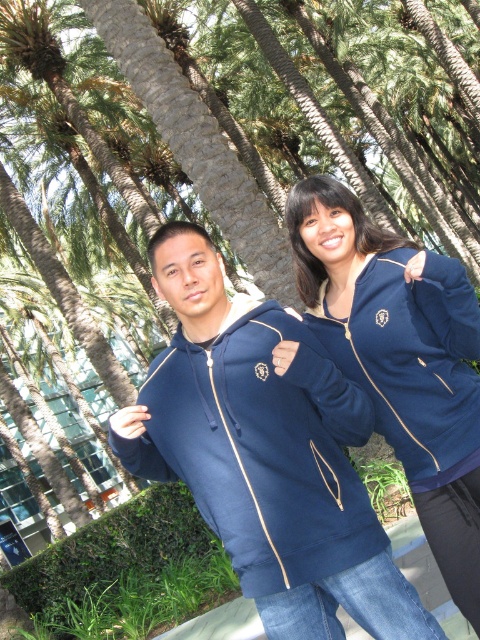
Who is higher up, navy blue hoodie at center or navy blue fleece sweatshirt at upper right?

navy blue fleece sweatshirt at upper right is higher up.

Looking at this image, is navy blue hoodie at center wider than navy blue fleece sweatshirt at upper right?

Yes, navy blue hoodie at center is wider than navy blue fleece sweatshirt at upper right.

Measure the distance between point (460,540) and camera.

Point (460,540) and camera are 2.20 meters apart.

Identify the location of navy blue hoodie at center. (402, 358).

Measure the distance between matte blue sweatshirt at center and camera.

The distance of matte blue sweatshirt at center from camera is 1.94 meters.

Where is `matte blue sweatshirt at center`? The image size is (480, 640). matte blue sweatshirt at center is located at coordinates (261, 448).

Is matte blue sweatshirt at center smaller than navy blue hoodie at center?

Correct, matte blue sweatshirt at center occupies less space than navy blue hoodie at center.

Does matte blue sweatshirt at center appear on the left side of navy blue hoodie at center?

Indeed, matte blue sweatshirt at center is positioned on the left side of navy blue hoodie at center.

Which is in front, point (345, 432) or point (418, 515)?

Point (345, 432)

You are a GUI agent. You are given a task and a screenshot of the screen. Output one action in this format:
    pyautogui.click(x=<x>, y=<y>)
    Task: Click on the matte blue sweatshirt at center
    This screenshot has width=480, height=640.
    Given the screenshot: What is the action you would take?
    pyautogui.click(x=261, y=448)